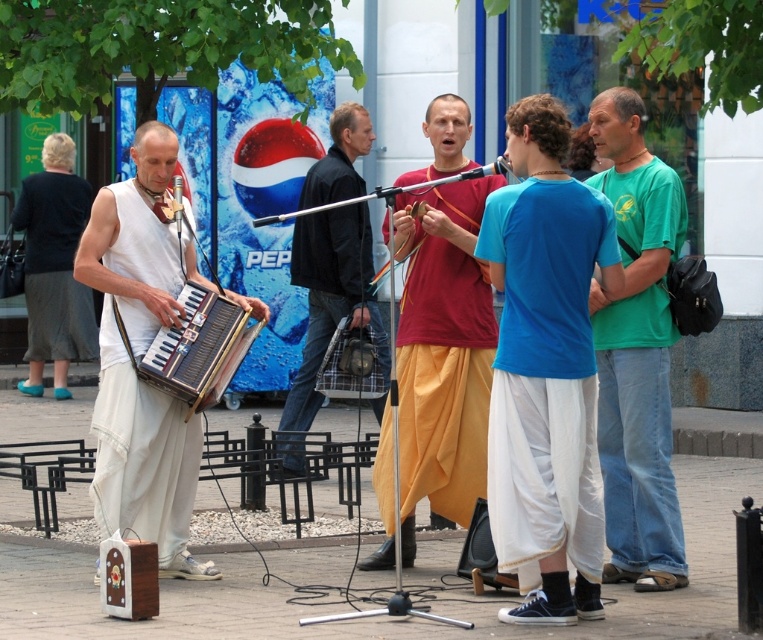
Which of these two, maroon fabric dhoti at center or green cotton t-shirt at right, stands taller?

Standing taller between the two is green cotton t-shirt at right.

Does maroon fabric dhoti at center come behind green cotton t-shirt at right?

That is True.

The height and width of the screenshot is (640, 763). What do you see at coordinates (443, 352) in the screenshot? I see `maroon fabric dhoti at center` at bounding box center [443, 352].

The image size is (763, 640). What are the coordinates of `maroon fabric dhoti at center` in the screenshot? It's located at tap(443, 352).

Between dark blue jacket at center and wooden accordion at left, which one has more height?

With more height is dark blue jacket at center.

Does dark blue jacket at center appear on the left side of wooden accordion at left?

Incorrect, dark blue jacket at center is not on the left side of wooden accordion at left.

Between point (345, 257) and point (221, 305), which one is positioned behind?

The point (345, 257) is behind.

At what (x,y) coordinates should I click in order to perform the action: click on dark blue jacket at center. Please return your answer as a coordinate pair (x, y). The width and height of the screenshot is (763, 640). Looking at the image, I should click on (330, 296).

Between point (683, 224) and point (58, 176), which one is positioned behind?

The point (58, 176) is behind.

Who is higher up, green cotton t-shirt at right or dark gray cotton robe at left?

dark gray cotton robe at left

At what (x,y) coordinates should I click in order to perform the action: click on green cotton t-shirt at right. Please return your answer as a coordinate pair (x, y). This screenshot has width=763, height=640. Looking at the image, I should click on (636, 353).